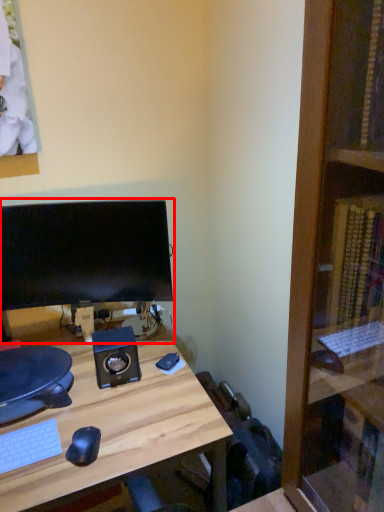
Question: Observing the image, what is the correct spatial positioning of computer monitor (annotated by the red box) in reference to desk?

Choices:
 (A) left
 (B) right

Answer: (A)